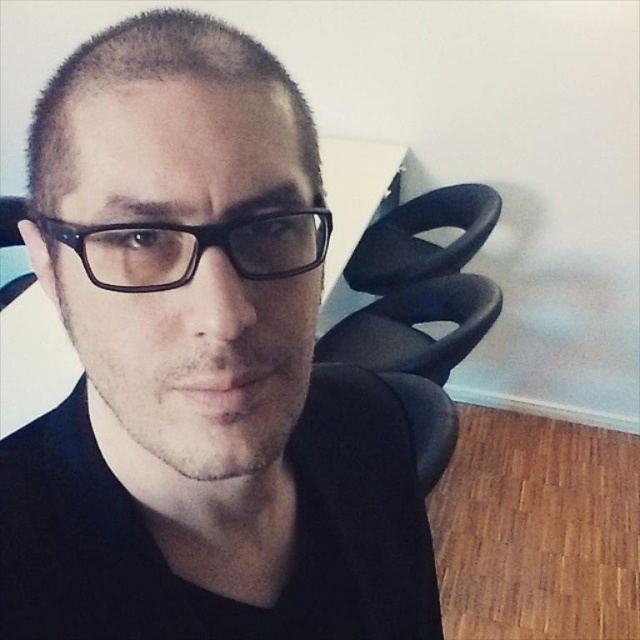
You are trying to decide which pair of glasses to wear. You have the matte black glasses at center and the black plastic glasses at center. Which pair covers more of your face?

A: The matte black glasses at center has a larger size compared to black plastic glasses at center, so it covers more of your face.

You are a photographer trying to capture a closeup of the matte black glasses at center. If your camera requires the subject to be at least 12 inches away to focus properly, will you need to adjust your position?

The distance between the matte black glasses at center and the camera is 11.05 inches, which is less than the required 12 inches. Therefore, you need to move the camera back to ensure proper focus.